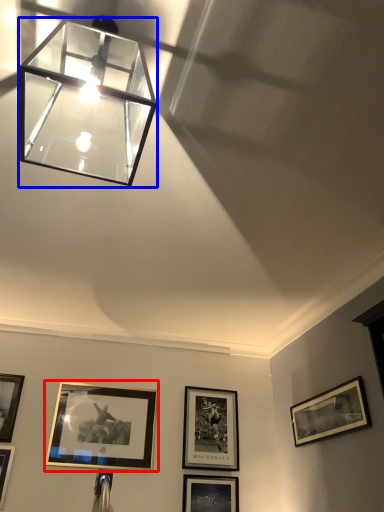
Question: Which point is further to the camera, picture frame (highlighted by a red box) or lamp (highlighted by a blue box)?

Choices:
 (A) picture frame
 (B) lamp

Answer: (A)